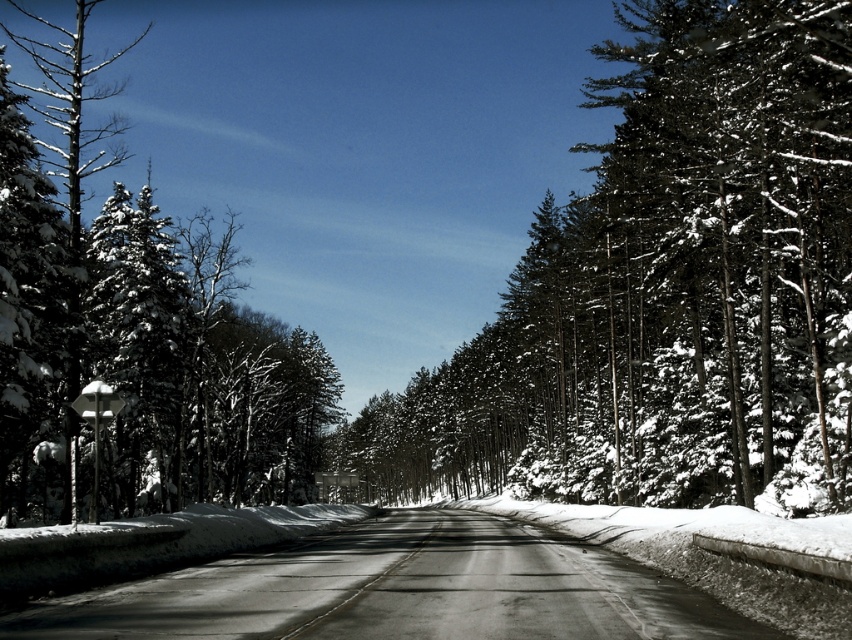
Question: Does snow-covered evergreen trees at center come behind snow-covered evergreen at left?

Choices:
 (A) no
 (B) yes

Answer: (A)

Question: In this image, where is snow-covered evergreen trees at center located relative to snow-covered evergreen at left?

Choices:
 (A) above
 (B) below

Answer: (B)

Question: Which point is closer to the camera?

Choices:
 (A) snow-covered evergreen at left
 (B) snow-covered evergreen trees at center

Answer: (B)

Question: Does snow-covered evergreen trees at center appear under snow-covered evergreen at left?

Choices:
 (A) no
 (B) yes

Answer: (B)